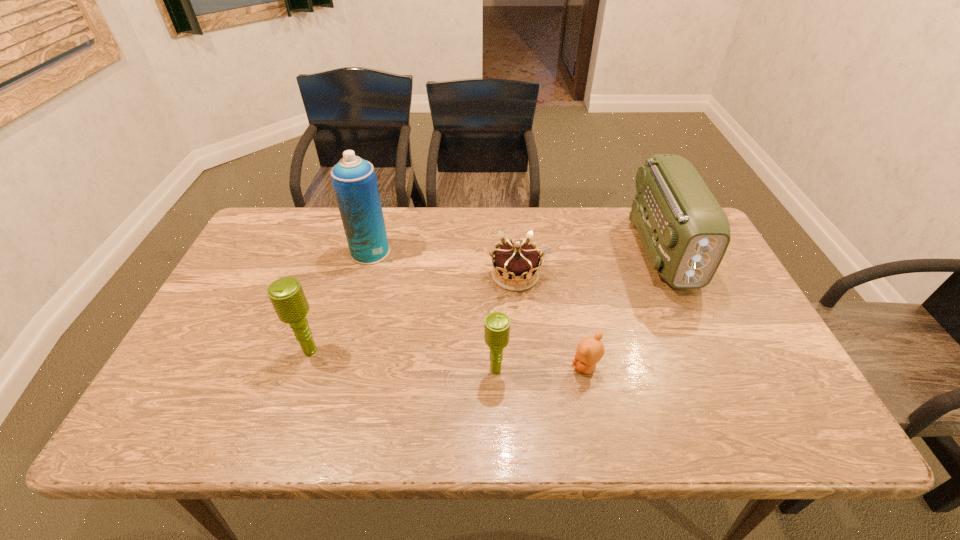
Given the evenly spaced microphones in the image, where should an extra microphone be added on the right to preserve the spacing? Please point to a vacant space. Please provide its 2D coordinates. Your answer should be formatted as a tuple, i.e. [(x, y)], where the tuple contains the x and y coordinates of a point satisfying the conditions above.

[(696, 392)]